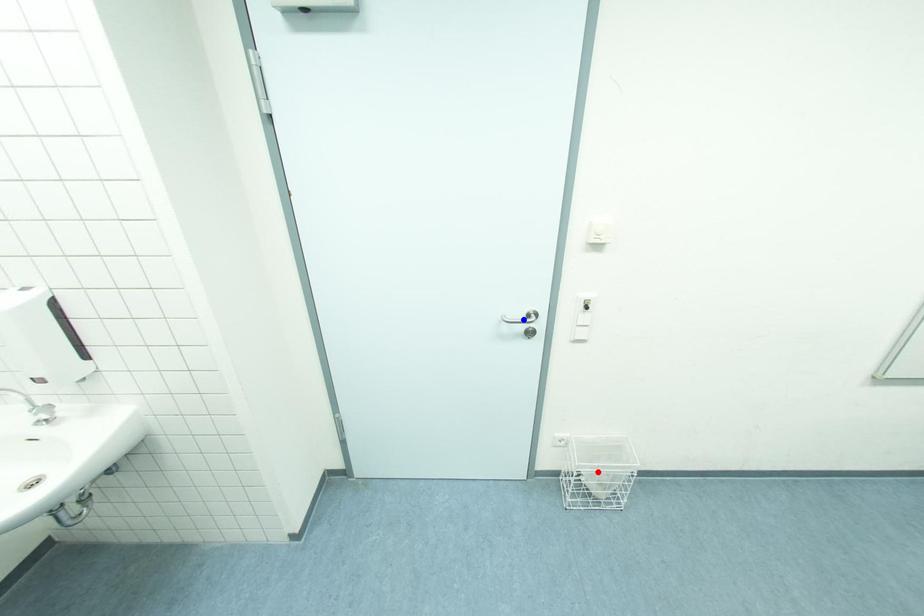
Question: Two points are marked on the image. Which point is closer to the camera?

Choices:
 (A) Blue point is closer.
 (B) Red point is closer.

Answer: (A)